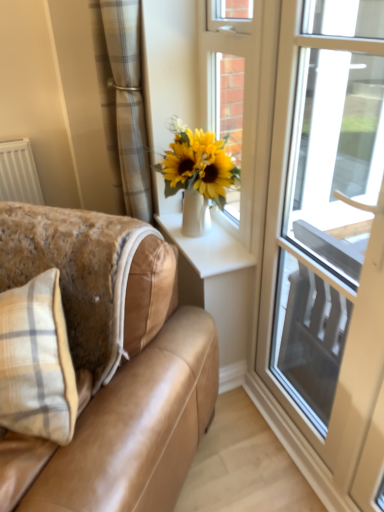
Question: Considering their positions, is plaid fabric curtain at upper left located in front of or behind transparent glass door at right?

Choices:
 (A) behind
 (B) front

Answer: (A)

Question: Is plaid fabric curtain at upper left inside or outside of transparent glass door at right?

Choices:
 (A) inside
 (B) outside

Answer: (B)

Question: Which object is positioned farthest from the white glossy door at upper center?

Choices:
 (A) white glossy vase at upper center
 (B) transparent glass door at right
 (C) tan leather couch at lower left
 (D) plaid fabric curtain at upper left

Answer: (B)

Question: Which of these objects is positioned farthest from the plaid fabric curtain at upper left?

Choices:
 (A) tan leather couch at lower left
 (B) transparent glass door at right
 (C) white glossy vase at upper center
 (D) white glossy door at upper center

Answer: (B)